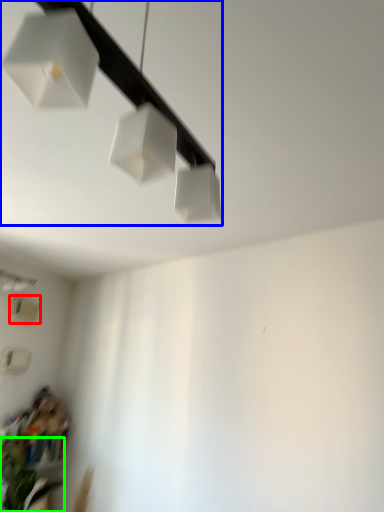
Question: Which object is the farthest from lamp (highlighted by a red box)? Choose among these: lamp (highlighted by a blue box) or plant (highlighted by a green box).

Choices:
 (A) lamp
 (B) plant

Answer: (A)